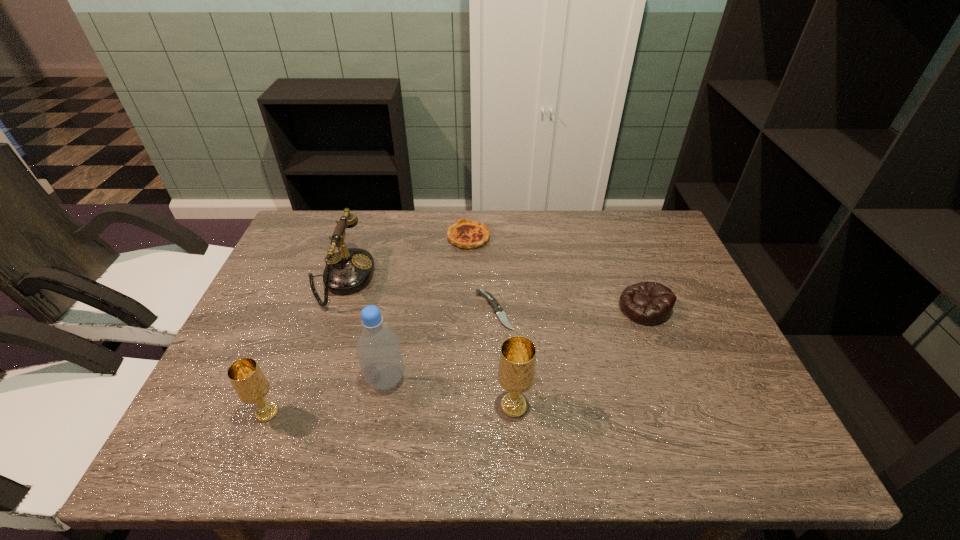
Locate an element on the screen. The height and width of the screenshot is (540, 960). the shorter chalice is located at coordinates (249, 382).

You are a GUI agent. You are given a task and a screenshot of the screen. Output one action in this format:
    pyautogui.click(x=<x>, y=<y>)
    Task: Click on the right chalice
    
    Given the screenshot: What is the action you would take?
    pyautogui.click(x=516, y=372)

Locate an element on the screen. quiche is located at coordinates (467, 234).

The width and height of the screenshot is (960, 540). In order to click on pocketknife in this screenshot , I will do `click(498, 310)`.

The image size is (960, 540). I want to click on telephone, so click(349, 270).

I want to click on the fifth tallest object, so click(648, 303).

Find the location of a particular element. the rightmost object is located at coordinates (648, 303).

At what (x,y) coordinates should I click in order to perform the action: click on the third object from left to right. Please return your answer as a coordinate pair (x, y). Looking at the image, I should click on (378, 349).

What are the coordinates of `the tallest object` in the screenshot? It's located at (378, 349).

Find the location of a particular element. This screenshot has height=540, width=960. vacant space located 0.150m on the right of the left chalice is located at coordinates pyautogui.click(x=352, y=412).